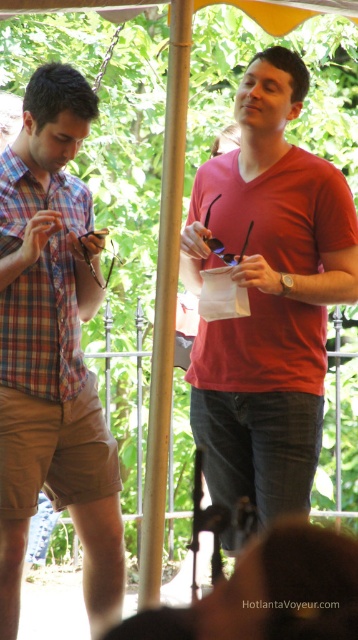
Who is higher up, matte red shirt at center or plaid cotton shorts at left?

matte red shirt at center

Describe the element at coordinates (268, 296) in the screenshot. The width and height of the screenshot is (358, 640). I see `matte red shirt at center` at that location.

Locate an element on the screen. matte red shirt at center is located at coordinates (268, 296).

Identify the location of matte red shirt at center. The height and width of the screenshot is (640, 358). (268, 296).

Does matte red shirt at center appear on the right side of plaid cotton shirt at left?

Correct, you'll find matte red shirt at center to the right of plaid cotton shirt at left.

How distant is matte red shirt at center from plaid cotton shirt at left?

75.37 centimeters

I want to click on matte red shirt at center, so click(268, 296).

Identify the location of matte red shirt at center. This screenshot has width=358, height=640. (268, 296).

Who is more forward, (51, 429) or (47, 312)?

Point (47, 312) is in front.

Who is more forward, (90,403) or (61,353)?

Point (61,353) is in front.

Locate an element on the screen. plaid cotton shorts at left is located at coordinates (52, 349).